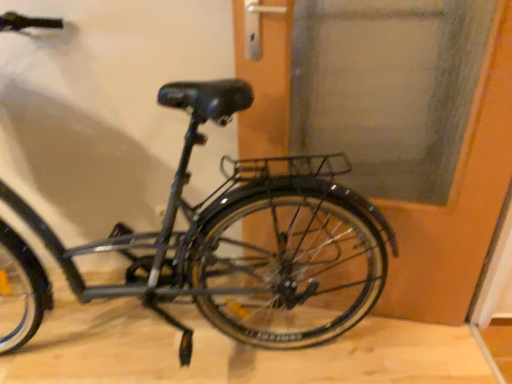
Where is `matte black bicycle at center`? The height and width of the screenshot is (384, 512). matte black bicycle at center is located at coordinates (236, 240).

What do you see at coordinates (236, 240) in the screenshot? The height and width of the screenshot is (384, 512). I see `matte black bicycle at center` at bounding box center [236, 240].

Where is `matte black bicycle at center`? This screenshot has width=512, height=384. matte black bicycle at center is located at coordinates (236, 240).